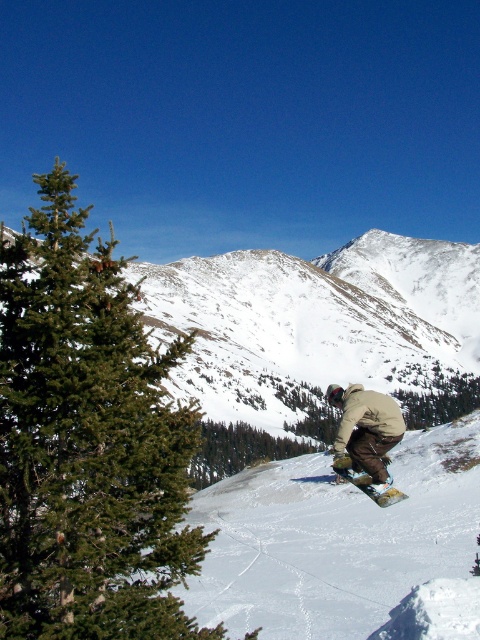
Does point (448, 307) come farther from viewer compared to point (466, 381)?

Yes, it is.

Can you confirm if snowy mountain at center is taller than green matte tree at lower center?

Yes, snowy mountain at center is taller than green matte tree at lower center.

What do you see at coordinates (313, 320) in the screenshot?
I see `snowy mountain at center` at bounding box center [313, 320].

This screenshot has height=640, width=480. I want to click on snowy mountain at center, so click(313, 320).

Between point (362, 401) and point (215, 435), which one is positioned in front?

Point (362, 401) is more forward.

Is point (365, 400) positioned behind point (238, 449)?

No.

Identify the location of tan fabric snowboarder at center. This screenshot has width=480, height=640. (367, 429).

Who is more forward, (468, 397) or (394, 500)?

Point (394, 500) is more forward.

Who is more distant from viewer, (445, 408) or (347, 465)?

The point (445, 408) is more distant.

The image size is (480, 640). I want to click on green matte tree at lower center, so click(435, 394).